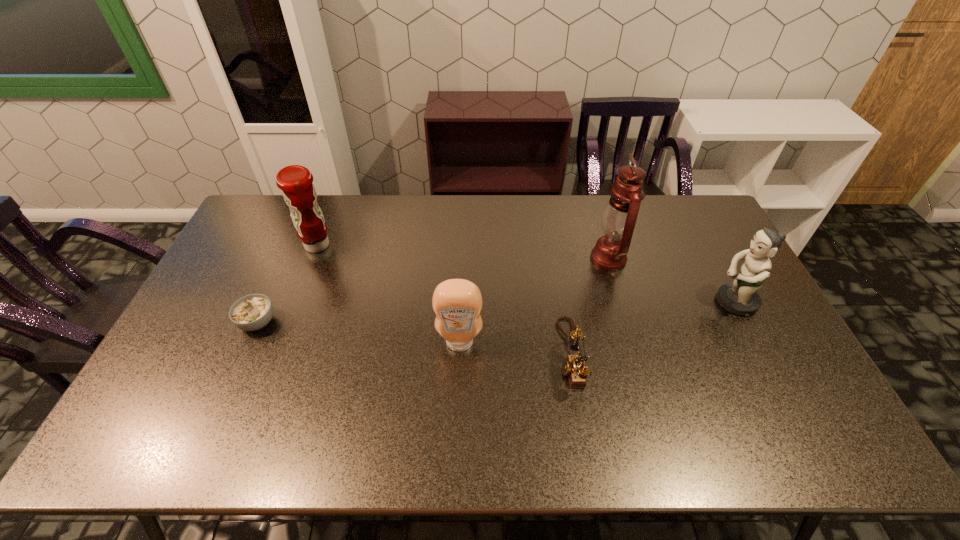
Locate an element on the screen. The width and height of the screenshot is (960, 540). free region located 0.050m on the back of the oil lamp is located at coordinates (601, 232).

What are the coordinates of `free space located on the right of the left condiment` in the screenshot? It's located at (449, 245).

Find the location of a particular element. free space located on the front-facing side of the figurine is located at coordinates (691, 302).

Where is `blank space located on the front-facing side of the figurine`? blank space located on the front-facing side of the figurine is located at coordinates (580, 302).

This screenshot has height=540, width=960. What are the coordinates of `vacant space located 0.230m on the front-facing side of the figurine` in the screenshot? It's located at (636, 302).

Image resolution: width=960 pixels, height=540 pixels. Identify the location of vacant space located 0.070m on the label of the fourth tallest object. (458, 376).

This screenshot has height=540, width=960. In order to click on vacant space positioned 0.170m on the front-facing side of the telephone in this screenshot , I will do `click(497, 354)`.

Where is `free space located on the front-facing side of the telephone`? free space located on the front-facing side of the telephone is located at coordinates (465, 354).

This screenshot has height=540, width=960. In order to click on blank space located 0.370m on the front-facing side of the telephone in this screenshot , I will do pyautogui.click(x=424, y=354).

Where is `vacant space located on the right of the shortest object`? This screenshot has height=540, width=960. vacant space located on the right of the shortest object is located at coordinates (301, 322).